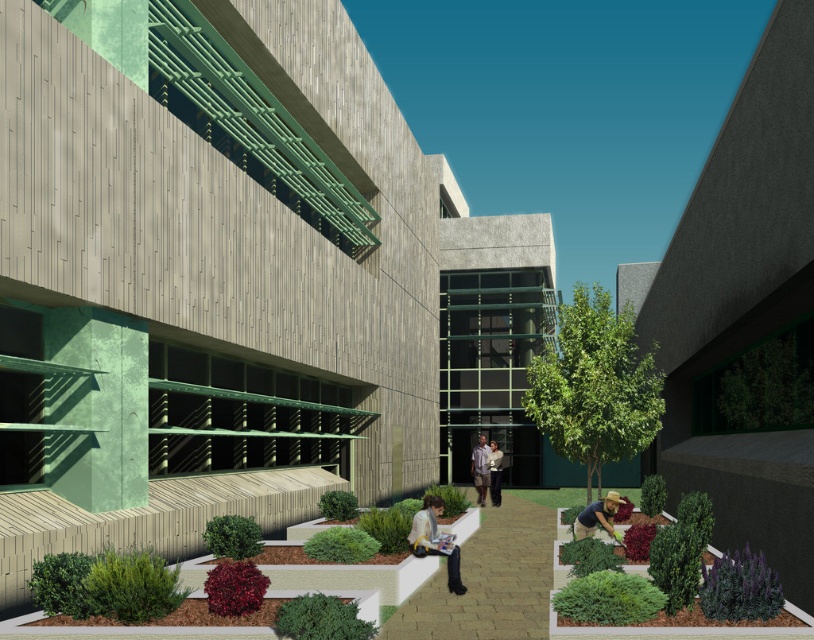
Question: Which point appears farthest from the camera in this image?

Choices:
 (A) (475, 454)
 (B) (456, 550)
 (C) (540, 557)
 (D) (602, 515)

Answer: (A)

Question: Where is smooth beige stone path at center located in relation to light brown shirt at center in the image?

Choices:
 (A) right
 (B) left

Answer: (B)

Question: Is smooth beige stone path at center closer to the viewer compared to light brown shirt at center?

Choices:
 (A) yes
 (B) no

Answer: (A)

Question: Does smooth beige stone path at center appear on the left side of brown leather gloves at lower right?

Choices:
 (A) no
 (B) yes

Answer: (B)

Question: Which object appears closest to the camera in this image?

Choices:
 (A) light brown leather jacket at center
 (B) brown leather gloves at lower right

Answer: (B)

Question: Which of the following is the closest to the observer?

Choices:
 (A) smooth beige stone path at center
 (B) light brown leather jacket at center
 (C) brown leather gloves at lower right

Answer: (A)